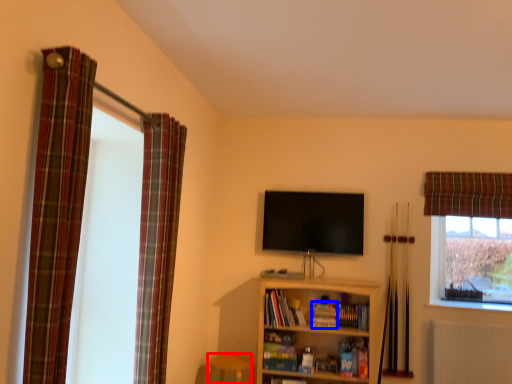
Question: Which point is closer to the camera, bar stool (highlighted by a red box) or book (highlighted by a blue box)?

Choices:
 (A) bar stool
 (B) book

Answer: (A)